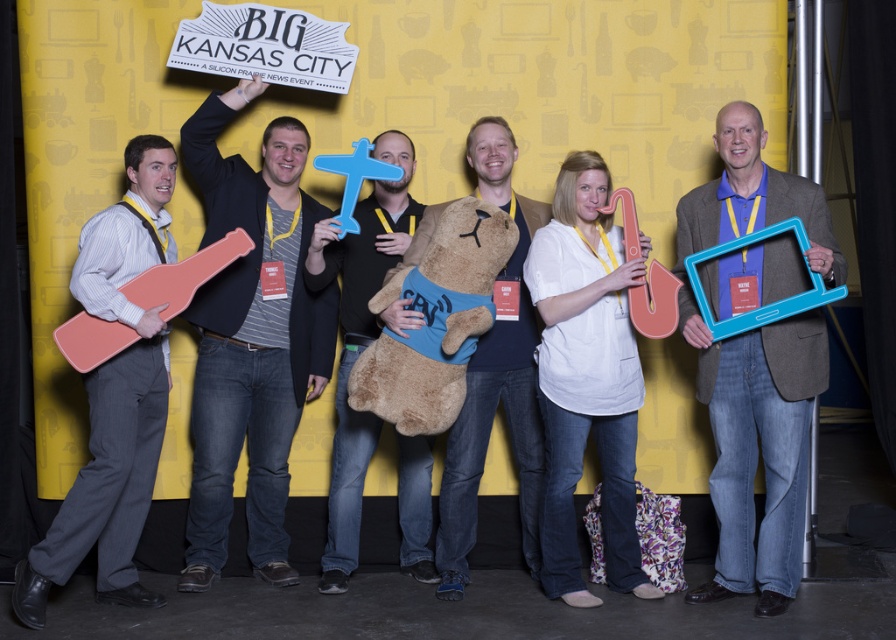
Which is in front, point (700, 586) or point (139, 586)?

Point (139, 586) is more forward.

Which of these two, blue plastic frame at center or brushed wood guitar at left, stands taller?

blue plastic frame at center is taller.

The height and width of the screenshot is (640, 896). What do you see at coordinates (756, 369) in the screenshot?
I see `blue plastic frame at center` at bounding box center [756, 369].

Locate an element on the screen. This screenshot has width=896, height=640. blue plastic frame at center is located at coordinates (756, 369).

Between blue plastic frame at center and striped cotton shirt at center, which one is positioned higher?

striped cotton shirt at center

Does point (785, 195) lie behind point (237, 189)?

No, it is in front of (237, 189).

Where is `blue plastic frame at center`? blue plastic frame at center is located at coordinates (756, 369).

Is the position of striped cotton shirt at center more distant than that of brushed wood guitar at left?

Yes, it is behind brushed wood guitar at left.

Does striped cotton shirt at center appear under brushed wood guitar at left?

No.

At what (x,y) coordinates should I click in order to perform the action: click on striped cotton shirt at center. Please return your answer as a coordinate pair (x, y). This screenshot has width=896, height=640. Looking at the image, I should click on (251, 339).